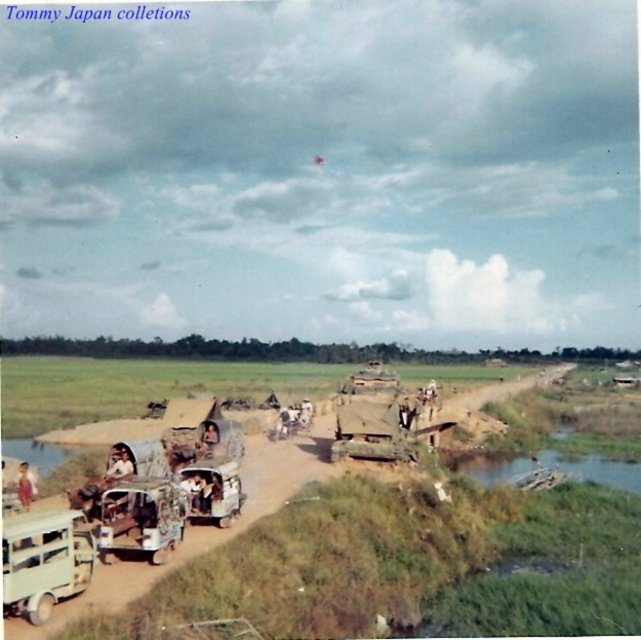
Who is lower down, light beige fabric truck at lower left or light brown fabric hat at center?

light beige fabric truck at lower left is below.

Is light beige fabric truck at lower left thinner than light brown fabric hat at center?

In fact, light beige fabric truck at lower left might be wider than light brown fabric hat at center.

Is point (22, 604) more distant than point (203, 420)?

That is False.

This screenshot has width=641, height=640. I want to click on light beige fabric truck at lower left, so click(44, 561).

Between light beige fabric truck at lower left and rusty metal truck at lower left, which one is positioned higher?

light beige fabric truck at lower left is above.

This screenshot has width=641, height=640. What are the coordinates of `light beige fabric truck at lower left` in the screenshot? It's located at (44, 561).

Is green grassy river at lower right bigger than light brown leather jacket at lower left?

Yes.

Can you confirm if green grassy river at lower right is thinner than light brown leather jacket at lower left?

No.

You are a GUI agent. You are given a task and a screenshot of the screen. Output one action in this format:
    pyautogui.click(x=<x>, y=<y>)
    Task: Click on the green grassy river at lower right
    The width and height of the screenshot is (641, 640).
    Given the screenshot: What is the action you would take?
    pyautogui.click(x=558, y=468)